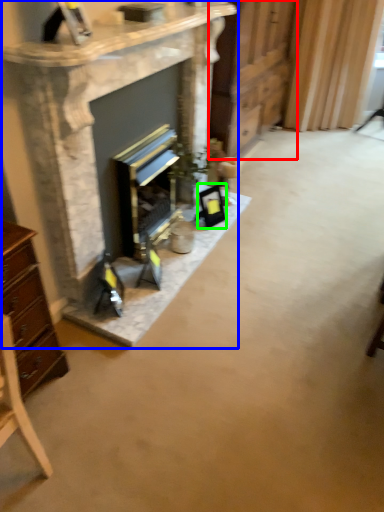
Question: Which is farther away from dresser (highlighted by a red box)? fireplace (highlighted by a blue box) or picture frame (highlighted by a green box)?

Choices:
 (A) fireplace
 (B) picture frame

Answer: (B)